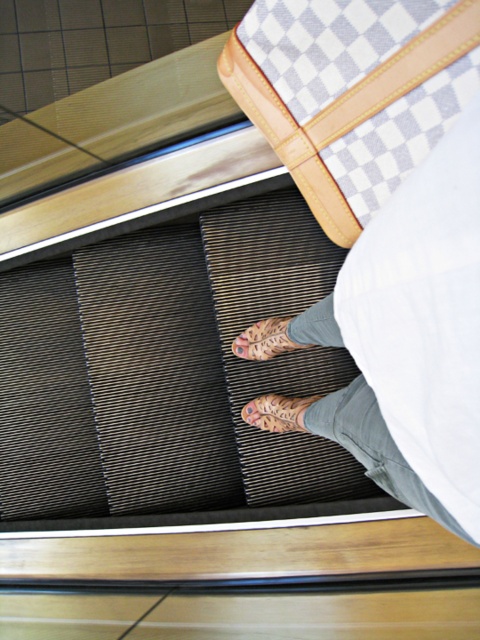
Is point (286, 404) more distant than point (244, 355)?

No, it is in front of (244, 355).

Is point (279, 400) positioned before point (284, 326)?

No, (279, 400) is behind (284, 326).

Find the location of a particular element. The image size is (480, 640). brown textured sandals at center is located at coordinates (276, 412).

Can you confirm if white checkered bag at center is smaller than white checkered fabric bag at upper center?

Yes, white checkered bag at center is smaller than white checkered fabric bag at upper center.

You are a GUI agent. You are given a task and a screenshot of the screen. Output one action in this format:
    pyautogui.click(x=<x>, y=<y>)
    Task: Click on the white checkered bag at center
    
    Given the screenshot: What is the action you would take?
    pyautogui.click(x=412, y=339)

Who is more distant from viewer, [408,291] or [296,406]?

Point [296,406]

Is white checkered bag at center bigger than brown textured sandals at center?

Indeed, white checkered bag at center has a larger size compared to brown textured sandals at center.

Image resolution: width=480 pixels, height=640 pixels. Identify the location of white checkered bag at center. (412, 339).